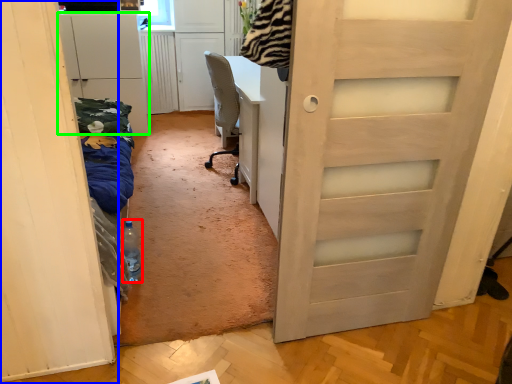
Question: Estimate the real-world distances between objects in this image. Which object is closer to bottle (highlighted by a red box), door (highlighted by a blue box) or cabinetry (highlighted by a green box)?

Choices:
 (A) door
 (B) cabinetry

Answer: (A)